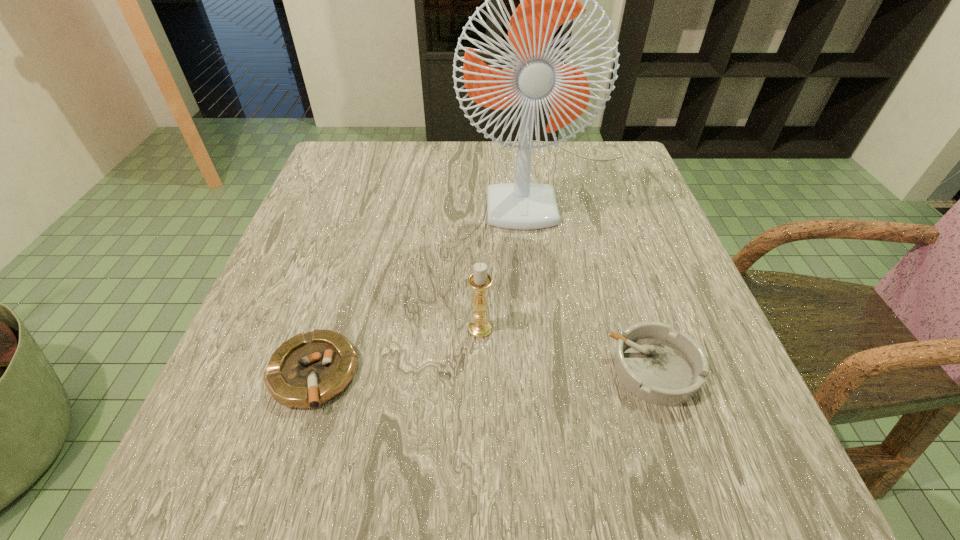
I want to click on vacant space at the near left corner of the desktop, so click(180, 508).

At what (x,y) coordinates should I click in order to perform the action: click on empty space between the leftmost object and the fan. Please return your answer as a coordinate pair (x, y). The height and width of the screenshot is (540, 960). Looking at the image, I should click on (430, 277).

Where is `free point between the right ashtray and the third shortest object`? The image size is (960, 540). free point between the right ashtray and the third shortest object is located at coordinates (566, 349).

What are the coordinates of `vacant region between the right ashtray and the shortest object` in the screenshot? It's located at (483, 372).

Image resolution: width=960 pixels, height=540 pixels. I want to click on free point between the shortest object and the third shortest object, so (396, 351).

Where is `free spot between the candle holder and the shortest object`? This screenshot has height=540, width=960. free spot between the candle holder and the shortest object is located at coordinates (396, 351).

Locate an element on the screen. free spot between the second tallest object and the shorter ashtray is located at coordinates point(396,351).

The width and height of the screenshot is (960, 540). Identify the location of vacant space in between the second tallest object and the right ashtray. (566, 349).

At what (x,y) coordinates should I click in order to perform the action: click on vacant area that lies between the farthest object and the leftmost object. Please return your answer as a coordinate pair (x, y). Looking at the image, I should click on (430, 277).

At what (x,y) coordinates should I click in order to perform the action: click on unoccupied position between the right ashtray and the fan. Please return your answer as a coordinate pair (x, y). The height and width of the screenshot is (540, 960). Looking at the image, I should click on (601, 275).